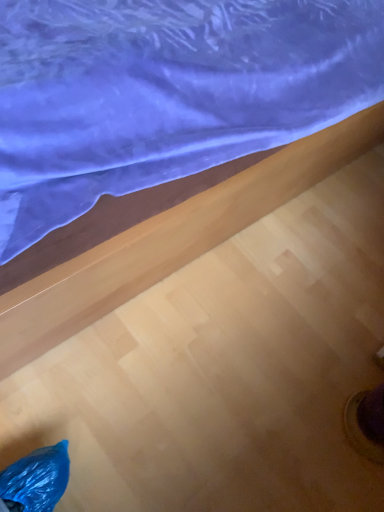
Locate an element on the screen. The height and width of the screenshot is (512, 384). free spot above wooden floor at upper center (from a real-world perspective) is located at coordinates (273, 317).